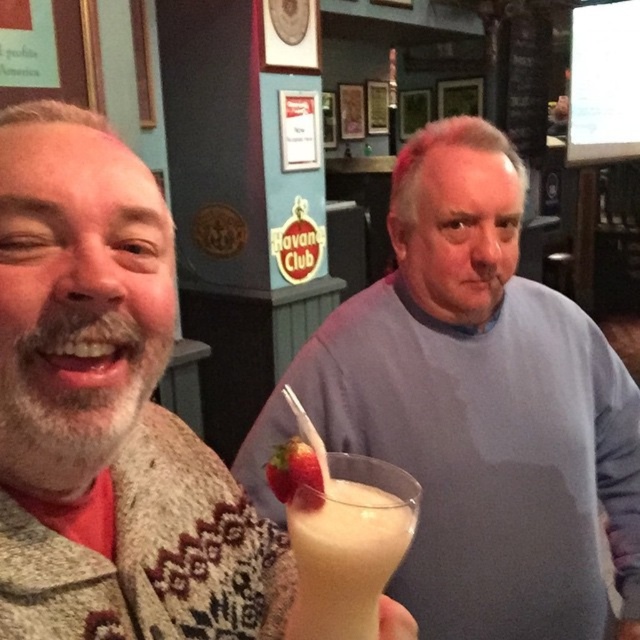
Based on the photo, who is positioned more to the right, gray matte sweater at center or knitted sweater at left?

gray matte sweater at center

Is gray matte sweater at center taller than knitted sweater at left?

Yes, gray matte sweater at center is taller than knitted sweater at left.

Is point (433, 406) behind point (35, 280)?

Yes, point (433, 406) is behind point (35, 280).

Image resolution: width=640 pixels, height=640 pixels. Identify the location of gray matte sweater at center. (483, 406).

Describe the element at coordinates (108, 413) in the screenshot. I see `knitted sweater at left` at that location.

Can you confirm if knitted sweater at left is positioned below white frothy milkshake at center?

No.

What do you see at coordinates (108, 413) in the screenshot? I see `knitted sweater at left` at bounding box center [108, 413].

Where is `knitted sweater at left`? The width and height of the screenshot is (640, 640). knitted sweater at left is located at coordinates (108, 413).

Can you confirm if gray matte sweater at center is thinner than white frothy milkshake at center?

No, gray matte sweater at center is not thinner than white frothy milkshake at center.

Measure the distance between gray matte sweater at center and camera.

The distance of gray matte sweater at center from camera is 38.56 inches.

In the scene shown: Who is more forward, (621, 467) or (388, 529)?

Point (388, 529)

This screenshot has height=640, width=640. What are the coordinates of `gray matte sweater at center` in the screenshot? It's located at (483, 406).